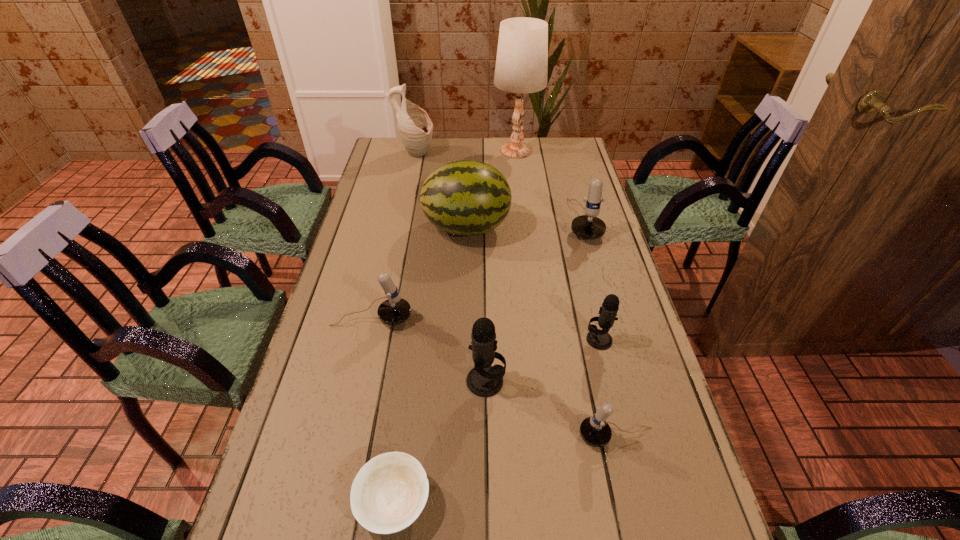
You are a GUI agent. You are given a task and a screenshot of the screen. Output one action in this format:
    pyautogui.click(x=<x>, y=<y>)
    Task: Click on the object that can be found as the second closest to the eighth shortest object
    This screenshot has height=540, width=960.
    Given the screenshot: What is the action you would take?
    466,198

Locate an element on the screen. The image size is (960, 540). the second closest microphone relative to the eighth tallest object is located at coordinates (599, 339).

Choose which microphone is the third nearest neighbor to the third nearest object. Please provide its 2D coordinates. Your answer should be formatted as a tuple, i.e. [(x, y)], where the tuple contains the x and y coordinates of a point satisfying the conditions above.

[(599, 339)]

Identify which white microphone is the closest to the eighth farthest object. Please provide its 2D coordinates. Your answer should be formatted as a tuple, i.e. [(x, y)], where the tuple contains the x and y coordinates of a point satisfying the conditions above.

[(395, 310)]

At what (x,y) coordinates should I click in order to perform the action: click on white microphone that is the second closest one to the fourth microphone from right to left. Please return your answer as a coordinate pair (x, y). Image resolution: width=960 pixels, height=540 pixels. Looking at the image, I should click on (395, 310).